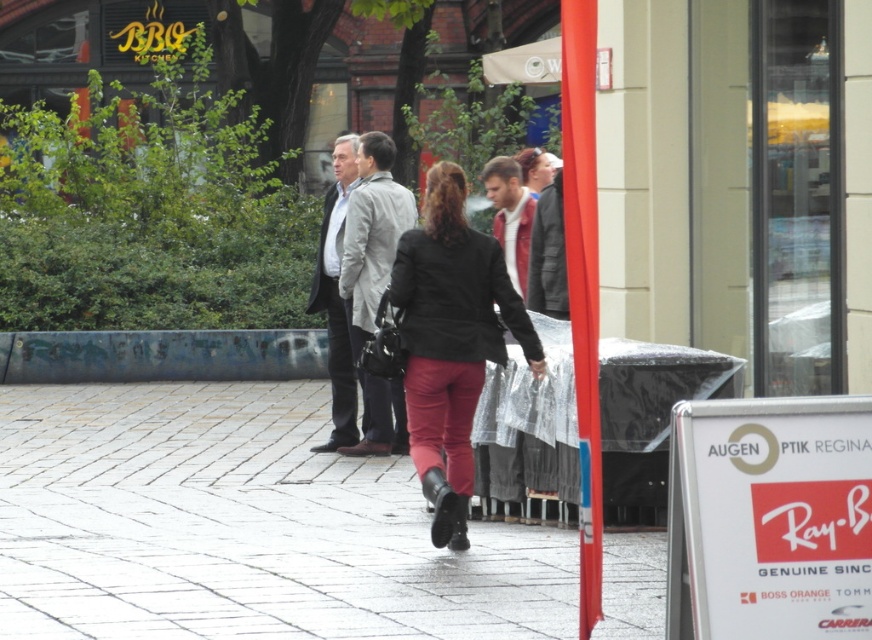
Question: Is smooth stone pavement at center wider than dark gray wool coat at center?

Choices:
 (A) no
 (B) yes

Answer: (B)

Question: Based on their relative distances, which object is farther from the dark gray fabric business suit at center?

Choices:
 (A) smooth stone pavement at center
 (B) matte black blazer at center
 (C) dark gray wool coat at center
 (D) smooth red pole at right

Answer: (D)

Question: Among these points, which one is farthest from the camera?

Choices:
 (A) (223, 396)
 (B) (335, 321)
 (C) (518, 221)
 (D) (390, 176)

Answer: (A)

Question: Considering the real-world distances, which object is farthest from the light gray fabric coat at center?

Choices:
 (A) smooth red pole at right
 (B) smooth stone pavement at center
 (C) dark gray fabric business suit at center

Answer: (A)

Question: Is light gray fabric coat at center to the right of dark gray wool coat at center from the viewer's perspective?

Choices:
 (A) yes
 (B) no

Answer: (A)

Question: Can you confirm if light gray fabric coat at center is bigger than dark gray wool coat at center?

Choices:
 (A) no
 (B) yes

Answer: (B)